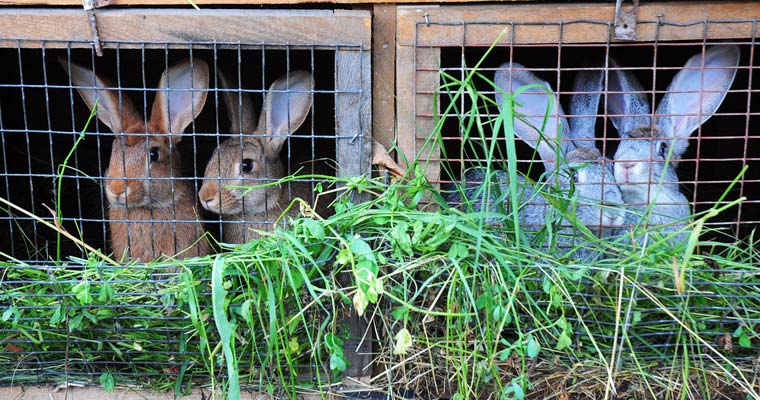
The height and width of the screenshot is (400, 760). I want to click on wires, so click(x=508, y=61), click(x=511, y=83), click(x=239, y=77), click(x=238, y=130).